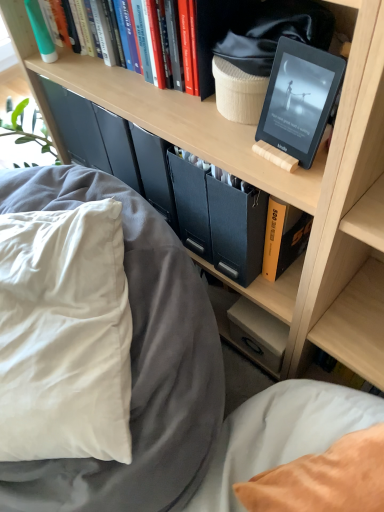
Describe the element at coordinates (283, 237) in the screenshot. I see `yellow hardcover book at center, the fourth book in the top-to-bottom sequence` at that location.

In order to face soft gray fabric bed at lower left, should I rotate leftwards or rightwards?

To face it directly, rotate left by 19.086 degrees.

What is the approximate height of soft gray fabric bed at lower left?

It is 24.59 inches.

Where is `white soft pillow at left`? white soft pillow at left is located at coordinates (64, 335).

In order to face wooden kindle at center, which is the second book from bottom to top, should I rotate leftwards or rightwards?

A 11.128 degree turn to the right will do.

Image resolution: width=384 pixels, height=512 pixels. What are the coordinates of `yellow hardcover book at center, which ranks as the 1th book in bottom-to-top order` in the screenshot? It's located at (283, 237).

From the image's perspective, is soft gray fabric bed at lower left located above wooden kindle at center, the 2th book when ordered from right to left?

No, from the image's perspective, soft gray fabric bed at lower left is not over wooden kindle at center, the 2th book when ordered from right to left.

Is wooden kindle at center, which is the second book from bottom to top, a part of soft gray fabric bed at lower left?

No, wooden kindle at center, which is the second book from bottom to top, is located outside of soft gray fabric bed at lower left.

Between soft gray fabric bed at lower left and wooden kindle at center, which is the second book from bottom to top, which one has more height?

soft gray fabric bed at lower left.

Is soft gray fabric bed at lower left not near wooden kindle at center, arranged as the 3th book when viewed from the left?

No, soft gray fabric bed at lower left is in close proximity to wooden kindle at center, arranged as the 3th book when viewed from the left.

Consider the image. Is yellow hardcover book at center, the fourth book in the top-to-bottom sequence, oriented away from wooden kindle at center, the 2th book when ordered from right to left?

yellow hardcover book at center, the fourth book in the top-to-bottom sequence, is not turned away from wooden kindle at center, the 2th book when ordered from right to left.

Considering the sizes of objects yellow hardcover book at center, the fourth book in the top-to-bottom sequence, and wooden kindle at center, the 3th book when ordered from top to bottom, in the image provided, who is smaller, yellow hardcover book at center, the fourth book in the top-to-bottom sequence, or wooden kindle at center, the 3th book when ordered from top to bottom,?

With smaller size is wooden kindle at center, the 3th book when ordered from top to bottom.

Looking at this image, from a real-world perspective, is yellow hardcover book at center, which is the first book in right-to-left order, under wooden kindle at center, which is the second book from bottom to top?

Yes, from a real-world perspective, yellow hardcover book at center, which is the first book in right-to-left order, is beneath wooden kindle at center, which is the second book from bottom to top.

In the image, there is a wooden kindle at center, which is the second book from bottom to top. Find the location of `book below it (from the image's perspective)`. book below it (from the image's perspective) is located at coordinates (283, 237).

Between soft gray fabric bed at lower left and white soft pillow at left, which one has smaller size?

white soft pillow at left.

Considering the sizes of objects soft gray fabric bed at lower left and white soft pillow at left in the image provided, who is wider, soft gray fabric bed at lower left or white soft pillow at left?

soft gray fabric bed at lower left.

Is soft gray fabric bed at lower left oriented towards white soft pillow at left?

No, soft gray fabric bed at lower left is not facing towards white soft pillow at left.

Does point (248, 477) lie behind point (91, 277)?

Yes, it is behind point (91, 277).

Between yellow hardcover book at center, which is the first book in right-to-left order, and black matte tablet at upper right, which one appears on the right side from the viewer's perspective?

From the viewer's perspective, yellow hardcover book at center, which is the first book in right-to-left order, appears more on the right side.

Can you tell me how much yellow hardcover book at center, which is the first book in right-to-left order, and black matte tablet at upper right differ in facing direction?

There is a 4.02-degree angle between the facing directions of yellow hardcover book at center, which is the first book in right-to-left order, and black matte tablet at upper right.

In the scene shown: Does yellow hardcover book at center, which is the first book in right-to-left order, turn towards black matte tablet at upper right?

No, yellow hardcover book at center, which is the first book in right-to-left order, does not turn towards black matte tablet at upper right.

Is yellow hardcover book at center, the fourth book in the top-to-bottom sequence, taller than black matte tablet at upper right?

Correct, yellow hardcover book at center, the fourth book in the top-to-bottom sequence, is much taller as black matte tablet at upper right.

Is hardcover books at upper center, the third book viewed from the right, next to green matte toothpaste tube at upper left, acting as the fourth book starting from the right?

hardcover books at upper center, the third book viewed from the right, is not next to green matte toothpaste tube at upper left, acting as the fourth book starting from the right, and they're not touching.

From a real-world perspective, count 1st books downward from the hardcover books at upper center, the third book viewed from the right, and point to it. Please provide its 2D coordinates.

[(41, 31)]

Which of these two, green matte toothpaste tube at upper left, which is the 2th book in top-to-bottom order, or hardcover books at upper center, which is the 4th book from bottom to top, is bigger?

hardcover books at upper center, which is the 4th book from bottom to top, is bigger.

Is green matte toothpaste tube at upper left, acting as the fourth book starting from the right, with hardcover books at upper center, the third book viewed from the right?

No, green matte toothpaste tube at upper left, acting as the fourth book starting from the right, is not beside hardcover books at upper center, the third book viewed from the right.

Is green matte toothpaste tube at upper left, acting as the fourth book starting from the right, outside of hardcover books at upper center, which appears as the 2th book when viewed from the left?

green matte toothpaste tube at upper left, acting as the fourth book starting from the right, is positioned outside hardcover books at upper center, which appears as the 2th book when viewed from the left.

Is point (216, 253) positioned in front of point (107, 337)?

That is False.

Image resolution: width=384 pixels, height=512 pixels. I want to click on pillow lying below the orange matte book at center (from the image's perspective), so pos(64,335).

In terms of height, does orange matte book at center look taller or shorter compared to white soft pillow at left?

orange matte book at center is shorter than white soft pillow at left.

Locate an element on the screen. Image resolution: width=384 pixels, height=512 pixels. bed that is below the wooden kindle at center, which is the second book from bottom to top (from the image's perspective) is located at coordinates (171, 381).

Find the location of a particular element. book on the right of wooden kindle at center, which is the second book from bottom to top is located at coordinates (283, 237).

When comparing their distances from black matte tablet at upper right, does hardcover books at upper center, which is the first book from top to bottom, or green matte toothpaste tube at upper left, marked as the first book in a left-to-right arrangement, seem closer?

hardcover books at upper center, which is the first book from top to bottom, is positioned closer to the anchor black matte tablet at upper right.

Estimate the real-world distances between objects in this image. Which object is closer to orange matte book at center, green matte toothpaste tube at upper left, which is the 3th book in bottom-to-top order, or soft gray fabric bed at lower left?

Among the two, soft gray fabric bed at lower left is located nearer to orange matte book at center.

Looking at the image, which one is located closer to orange matte book at center, black matte tablet at upper right or green matte toothpaste tube at upper left, marked as the first book in a left-to-right arrangement?

black matte tablet at upper right.

Estimate the real-world distances between objects in this image. Which object is further from soft gray fabric bed at lower left, hardcover books at upper center, which is the first book from top to bottom, or wooden kindle at center, the 2th book when ordered from right to left?

hardcover books at upper center, which is the first book from top to bottom, lies further to soft gray fabric bed at lower left than the other object.

Considering their positions, is wooden kindle at center, arranged as the 3th book when viewed from the left, positioned closer to white soft pillow at left than green matte toothpaste tube at upper left, which is the 3th book in bottom-to-top order?

wooden kindle at center, arranged as the 3th book when viewed from the left, is positioned closer to the anchor white soft pillow at left.

Looking at the image, which one is located closer to white soft pillow at left, orange matte book at center or soft gray fabric bed at lower left?

Based on the image, soft gray fabric bed at lower left appears to be nearer to white soft pillow at left.

Looking at the image, which one is located closer to green matte toothpaste tube at upper left, which is the 2th book in top-to-bottom order, white soft pillow at left or orange matte book at center?

orange matte book at center is closer to green matte toothpaste tube at upper left, which is the 2th book in top-to-bottom order.

Looking at the image, which one is located closer to black matte tablet at upper right, soft gray fabric bed at lower left or orange matte book at center?

Among the two, orange matte book at center is located nearer to black matte tablet at upper right.

Where is `pillow between hardcover books at upper center, which appears as the 2th book when viewed from the left, and soft gray fabric bed at lower left, in the vertical direction`? pillow between hardcover books at upper center, which appears as the 2th book when viewed from the left, and soft gray fabric bed at lower left, in the vertical direction is located at coordinates (64, 335).

Identify the location of pillow between green matte toothpaste tube at upper left, which is the 2th book in top-to-bottom order, and soft gray fabric bed at lower left in the up-down direction. Image resolution: width=384 pixels, height=512 pixels. (64, 335).

At what (x,y) coordinates should I click in order to perform the action: click on paperback book between white soft pillow at left and yellow hardcover book at center, which is the first book in right-to-left order. Please return your answer as a coordinate pair (x, y). Image resolution: width=384 pixels, height=512 pixels. Looking at the image, I should click on (237, 229).

Locate an element on the screen. The height and width of the screenshot is (512, 384). paperback book between black matte tablet at upper right and yellow hardcover book at center, the fourth book in the top-to-bottom sequence, from front to back is located at coordinates (237, 229).